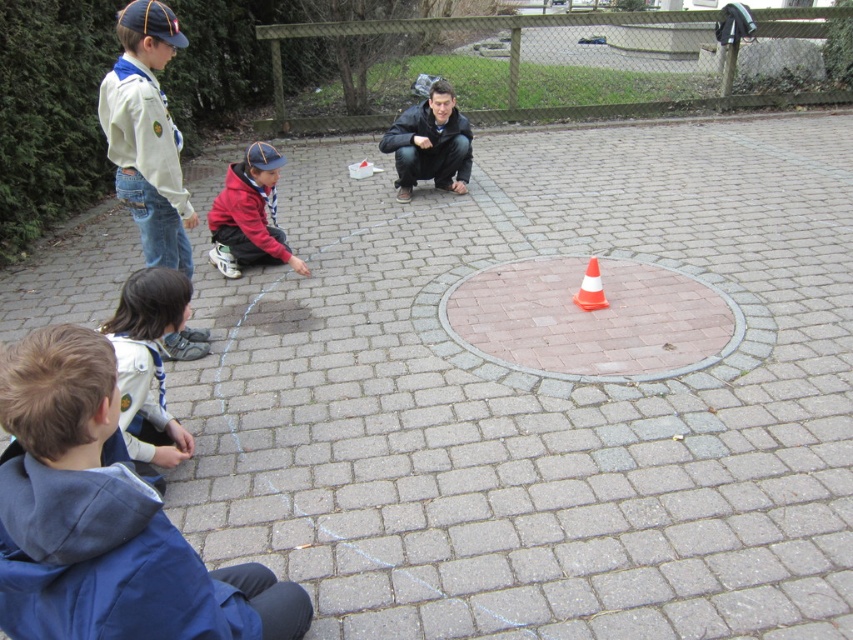
Question: Estimate the real-world distances between objects in this image. Which object is farther from the pink brick circle at center?

Choices:
 (A) orange/white striped cone at center
 (B) red fleece jacket at center
 (C) white matte uniform at upper left
 (D) blue fleece jacket at lower left

Answer: (D)

Question: Is blue fleece jacket at lower left closer to the viewer compared to red fleece jacket at center?

Choices:
 (A) yes
 (B) no

Answer: (A)

Question: Estimate the real-world distances between objects in this image. Which object is farther from the red fleece jacket at center?

Choices:
 (A) white matte uniform at upper left
 (B) blue fleece jacket at lower left
 (C) orange/white striped cone at center
 (D) dark blue fleece jacket at lower left

Answer: (B)

Question: Which of these objects is positioned farthest from the orange/white striped cone at center?

Choices:
 (A) pink brick circle at center
 (B) red fleece jacket at center
 (C) white matte uniform at upper left

Answer: (C)

Question: Does dark blue fleece jacket at lower left lie in front of orange/white striped cone at center?

Choices:
 (A) yes
 (B) no

Answer: (A)

Question: Can you confirm if white matte uniform at upper left is wider than dark blue fleece jacket at lower left?

Choices:
 (A) yes
 (B) no

Answer: (A)